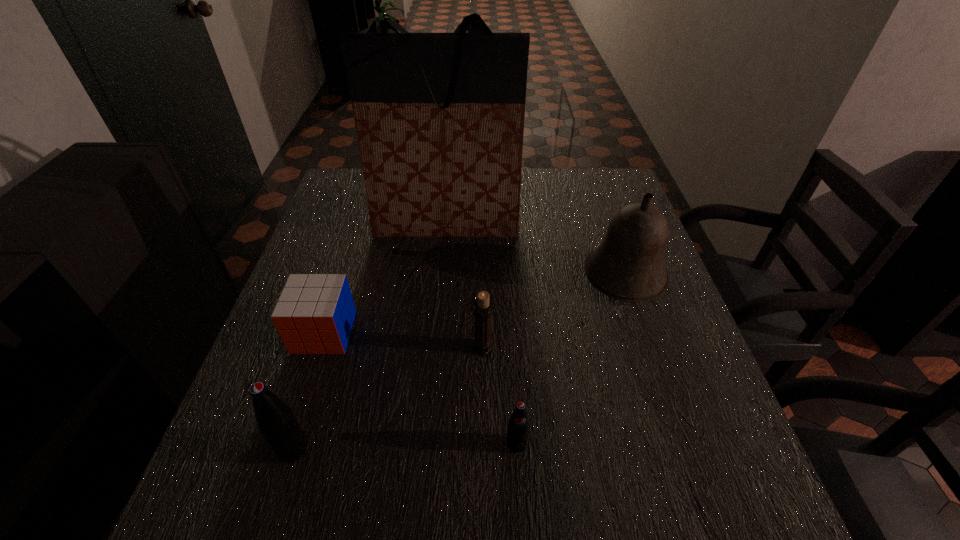
Where is `object at the near left corner`? The width and height of the screenshot is (960, 540). object at the near left corner is located at coordinates (275, 419).

Identify the location of free space at the far edge. (528, 205).

Where is `vacant space at the near edge of the desktop`? vacant space at the near edge of the desktop is located at coordinates (428, 451).

This screenshot has height=540, width=960. What are the coordinates of `free location at the left edge of the desktop` in the screenshot? It's located at (258, 365).

This screenshot has width=960, height=540. What are the coordinates of `free region at the right edge of the desktop` in the screenshot? It's located at click(684, 365).

Locate an element on the screen. This screenshot has width=960, height=540. vacant space at the far right corner is located at coordinates 592,202.

The image size is (960, 540). Identify the location of blank region between the right pop and the cube. (420, 388).

Locate an element on the screen. vacant point located between the shopping bag and the fifth nearest object is located at coordinates (536, 250).

This screenshot has width=960, height=540. I want to click on free space that is in between the cube and the farthest object, so click(385, 278).

Where is `vacant space in between the tallest object and the cube`? The image size is (960, 540). vacant space in between the tallest object and the cube is located at coordinates (385, 278).